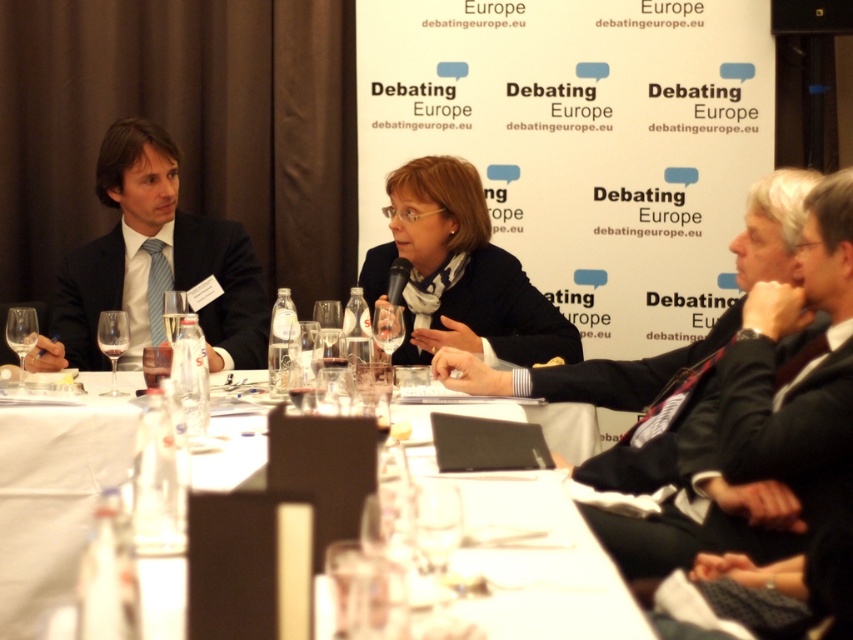
You are a photographer preparing to take a group photo of the panelists. You need to ensure that the dark gray suit at center and the matte black suit at left are both clearly visible in the frame. Considering their sizes, which panelist should you position closer to the camera to maintain visual balance?

The dark gray suit at center is larger in size than the matte black suit at left, so positioning the smaller matte black suit at left closer to the camera will help balance their visual presence.